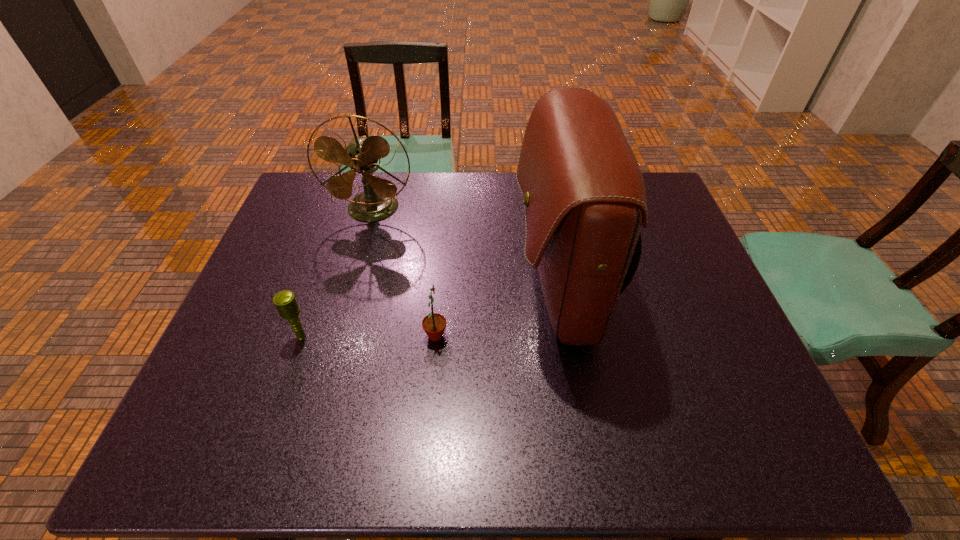
Where is `vacant area situated 0.220m in front of the second tallest object, directing air flow`? vacant area situated 0.220m in front of the second tallest object, directing air flow is located at coordinates (353, 279).

Image resolution: width=960 pixels, height=540 pixels. Identify the location of vacant space located on the face of the sunflower. (511, 336).

Find the location of `vacant region located 0.230m on the back of the shortest object`. vacant region located 0.230m on the back of the shortest object is located at coordinates (327, 263).

Image resolution: width=960 pixels, height=540 pixels. In order to click on object at the far edge in this screenshot , I will do `click(378, 201)`.

This screenshot has width=960, height=540. What are the coordinates of `fan that is positioned at the left edge` in the screenshot? It's located at (378, 201).

I want to click on microphone located in the left edge section of the desktop, so click(x=285, y=301).

I want to click on object that is at the far left corner, so click(x=378, y=201).

Where is `vacant area at the far edge of the desktop`? This screenshot has width=960, height=540. vacant area at the far edge of the desktop is located at coordinates (396, 184).

Locate an element on the screen. This screenshot has height=540, width=960. free location at the near edge of the desktop is located at coordinates (706, 448).

In the image, there is a desktop. At what (x,y) coordinates should I click in order to perform the action: click on vacant area at the left edge. Please return your answer as a coordinate pair (x, y). The image size is (960, 540). Looking at the image, I should click on (308, 238).